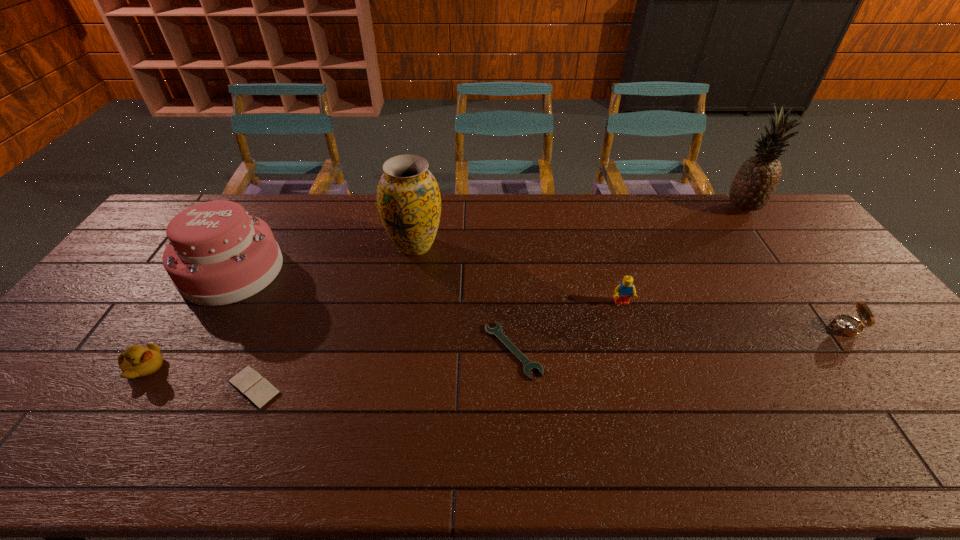
At what (x,y) coordinates should I click in order to perform the action: click on vacant region located 0.200m on the back of the fifth object from left to right. Please return your answer as a coordinate pair (x, y). Looking at the image, I should click on (x=508, y=273).

The width and height of the screenshot is (960, 540). I want to click on pineapple located at the far edge, so click(x=754, y=184).

Where is `vase that is positioned at the far edge`? Image resolution: width=960 pixels, height=540 pixels. vase that is positioned at the far edge is located at coordinates (408, 197).

Locate an element on the screen. pineapple present at the right edge is located at coordinates (754, 184).

The height and width of the screenshot is (540, 960). I want to click on compass that is at the right edge, so click(x=847, y=325).

In order to click on object that is at the far right corner in this screenshot , I will do `click(754, 184)`.

In order to click on vacant region at the far edge in this screenshot , I will do `click(738, 226)`.

This screenshot has height=540, width=960. What are the coordinates of `vacant space at the near edge of the desktop` in the screenshot? It's located at pyautogui.click(x=535, y=458).

The image size is (960, 540). I want to click on vacant area at the left edge, so click(38, 419).

This screenshot has width=960, height=540. I want to click on free space at the right edge, so click(956, 404).